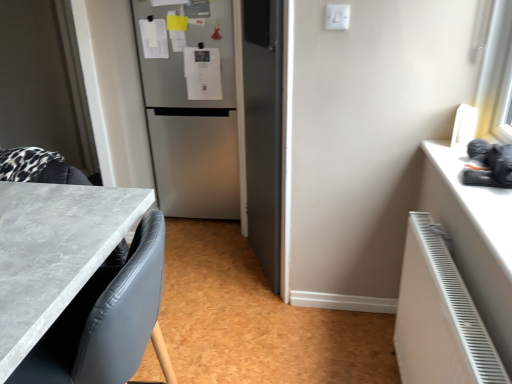
Locate an element on the screen. Image resolution: width=512 pixels, height=384 pixels. vacant space in front of stainless steel refrigerator at center is located at coordinates (203, 242).